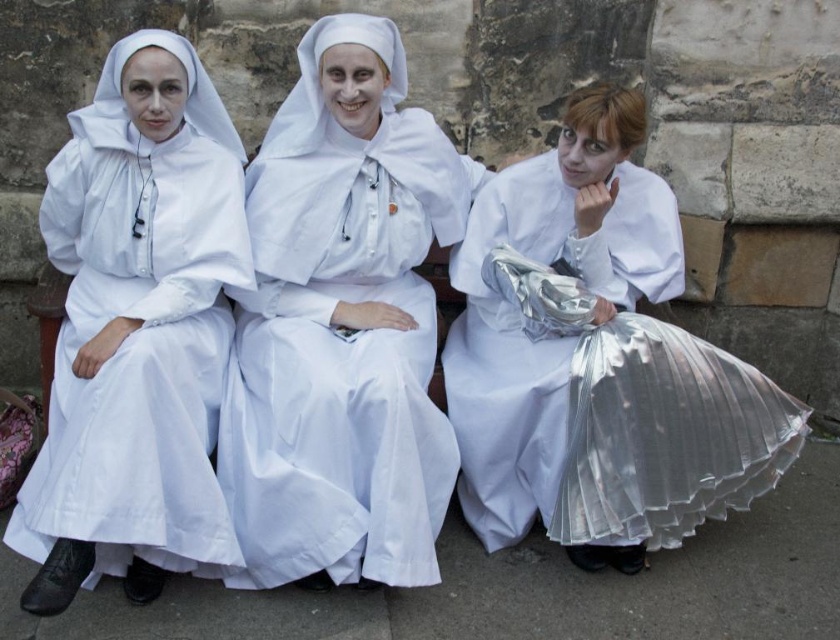
Question: Which point appears closest to the camera in this image?

Choices:
 (A) (190, 168)
 (B) (360, 196)

Answer: (A)

Question: Can you confirm if shiny metallic skirt at center is positioned above white matte nun's habit at left?

Choices:
 (A) yes
 (B) no

Answer: (B)

Question: Where is shiny metallic skirt at center located in relation to white matte nun's habit at left in the image?

Choices:
 (A) above
 (B) below

Answer: (B)

Question: Does white matte nun's habit at center appear on the right side of shiny metallic skirt at center?

Choices:
 (A) yes
 (B) no

Answer: (B)

Question: Which point appears farthest from the camera in this image?

Choices:
 (A) (739, 506)
 (B) (277, 500)
 (C) (130, 564)

Answer: (A)

Question: Which point is closer to the camera?

Choices:
 (A) (602, 228)
 (B) (331, 44)
 (C) (66, 188)

Answer: (C)